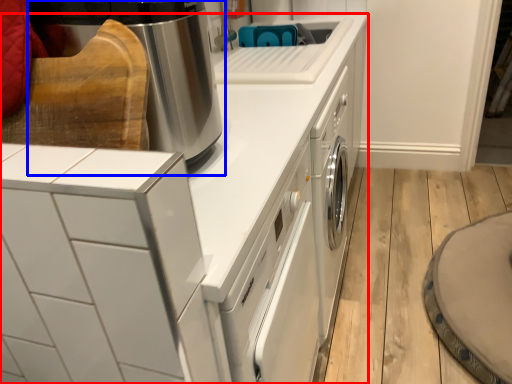
Question: Which object appears closest to the camera in this image, home appliance (highlighted by a red box) or home appliance (highlighted by a blue box)?

Choices:
 (A) home appliance
 (B) home appliance

Answer: (A)